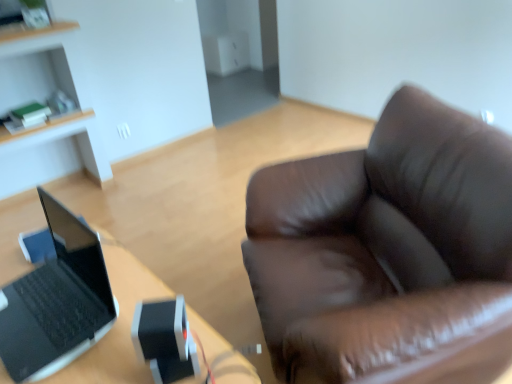
Question: From a real-world perspective, is black plastic laptop at left positioned over light wood cabinet at upper left based on gravity?

Choices:
 (A) yes
 (B) no

Answer: (B)

Question: Can you confirm if black plastic laptop at left is thinner than light wood cabinet at upper left?

Choices:
 (A) no
 (B) yes

Answer: (A)

Question: Considering the relative sizes of black plastic laptop at left and light wood cabinet at upper left in the image provided, is black plastic laptop at left bigger than light wood cabinet at upper left?

Choices:
 (A) yes
 (B) no

Answer: (B)

Question: From the image's perspective, is black plastic laptop at left on top of light wood cabinet at upper left?

Choices:
 (A) no
 (B) yes

Answer: (A)

Question: Is black plastic laptop at left wider than light wood cabinet at upper left?

Choices:
 (A) yes
 (B) no

Answer: (A)

Question: Could you tell me if black plastic laptop at left is turned towards light wood cabinet at upper left?

Choices:
 (A) no
 (B) yes

Answer: (A)

Question: Is light wood cabinet at upper left at the right side of black plastic laptop at left?

Choices:
 (A) no
 (B) yes

Answer: (A)

Question: Is black plastic laptop at left at the back of light wood cabinet at upper left?

Choices:
 (A) yes
 (B) no

Answer: (B)

Question: Is light wood cabinet at upper left aimed at black plastic laptop at left?

Choices:
 (A) no
 (B) yes

Answer: (B)

Question: Does light wood cabinet at upper left have a greater width compared to black plastic laptop at left?

Choices:
 (A) no
 (B) yes

Answer: (A)

Question: Would you say black plastic laptop at left is part of light wood cabinet at upper left's contents?

Choices:
 (A) yes
 (B) no

Answer: (B)

Question: From a real-world perspective, is light wood cabinet at upper left physically above black plastic laptop at left?

Choices:
 (A) no
 (B) yes

Answer: (B)

Question: Are black matte laptop at left and black plastic laptop at left far apart?

Choices:
 (A) no
 (B) yes

Answer: (A)